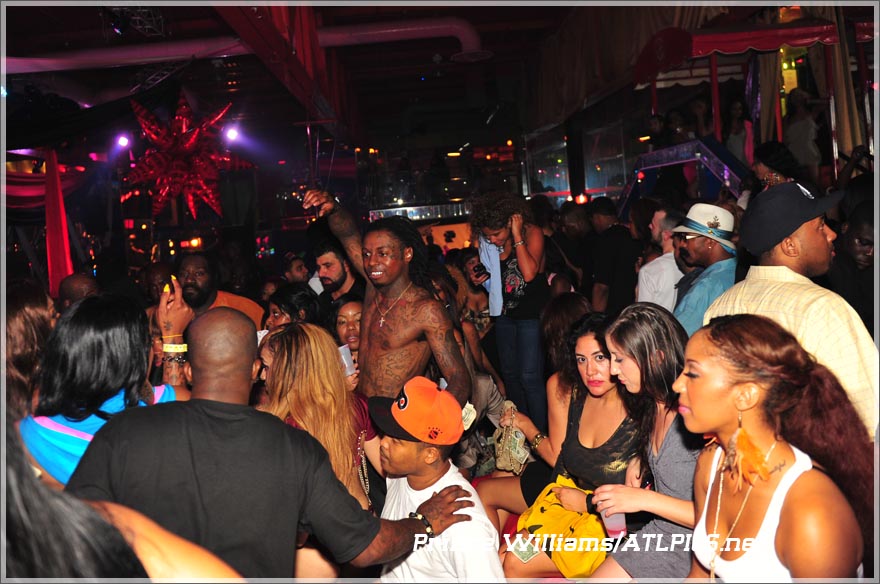
Find the location of a particular element. The height and width of the screenshot is (584, 880). her left earring is located at coordinates (746, 460).